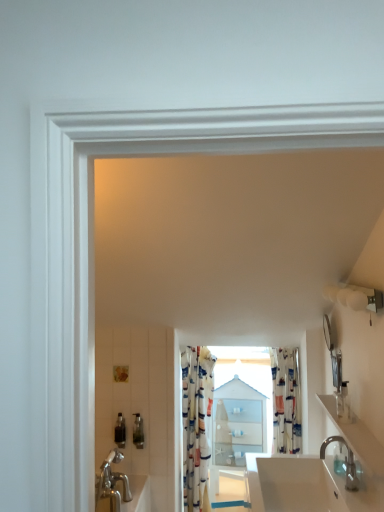
Where is `printed fabric shower curtain at center, the 2th shower curtain in the left-to-right sequence`? The height and width of the screenshot is (512, 384). printed fabric shower curtain at center, the 2th shower curtain in the left-to-right sequence is located at coordinates [x=286, y=400].

What do you see at coordinates (297, 484) in the screenshot? The height and width of the screenshot is (512, 384). I see `white glossy sink at lower center` at bounding box center [297, 484].

What do you see at coordinates (343, 402) in the screenshot? I see `clear plastic soap dispenser at right, the first toiletry positioned from the top` at bounding box center [343, 402].

Locate an element on the screen. The image size is (384, 512). clear plastic soap dispenser at right, positioned as the 2th toiletry in bottom-to-top order is located at coordinates (343, 402).

What do you see at coordinates (120, 431) in the screenshot?
I see `translucent plastic soap dispenser at lower left, which is counted as the first toiletry, starting from the bottom` at bounding box center [120, 431].

Find the location of `printed fabric shower curtain at center, the 1th shower curtain positioned from the right`. printed fabric shower curtain at center, the 1th shower curtain positioned from the right is located at coordinates (286, 400).

Which object is positioned more to the left, translucent plastic soap dispenser at lower left, the 2th toiletry viewed from the front, or white glossy countertop at lower right?

translucent plastic soap dispenser at lower left, the 2th toiletry viewed from the front.

Which point is more distant from viewer, (117,428) or (364,504)?

The point (117,428) is behind.

From a real-world perspective, is translucent plastic soap dispenser at lower left, positioned as the 1th toiletry in back-to-front order, under white glossy countertop at lower right?

Yes, from a real-world perspective, translucent plastic soap dispenser at lower left, positioned as the 1th toiletry in back-to-front order, is below white glossy countertop at lower right.

Considering the relative sizes of translucent plastic soap dispenser at lower left, the 2th toiletry in the top-to-bottom sequence, and white glossy countertop at lower right in the image provided, is translucent plastic soap dispenser at lower left, the 2th toiletry in the top-to-bottom sequence, smaller than white glossy countertop at lower right?

Yes.

From the image's perspective, between floral fabric shower curtain at center, which ranks as the 1th shower curtain in left-to-right order, and white glossy sink at lower center, which one is located above?

white glossy sink at lower center.

Is floral fabric shower curtain at center, arranged as the second shower curtain when viewed from the right, next to white glossy sink at lower center?

They are not placed beside each other.

Looking at this image, is floral fabric shower curtain at center, arranged as the second shower curtain when viewed from the right, spatially inside white glossy sink at lower center, or outside of it?

floral fabric shower curtain at center, arranged as the second shower curtain when viewed from the right, is outside white glossy sink at lower center.

Based on their sizes in the image, would you say floral fabric shower curtain at center, which ranks as the 1th shower curtain in left-to-right order, is bigger or smaller than white glossy sink at lower center?

In the image, floral fabric shower curtain at center, which ranks as the 1th shower curtain in left-to-right order, appears to be larger than white glossy sink at lower center.

Which object is wider, white glossy cabinet at center or floral fabric shower curtain at center, arranged as the second shower curtain when viewed from the right?

white glossy cabinet at center.

Is white glossy cabinet at center positioned with its back to floral fabric shower curtain at center, which ranks as the 1th shower curtain in left-to-right order?

No, floral fabric shower curtain at center, which ranks as the 1th shower curtain in left-to-right order, is not at the back of white glossy cabinet at center.

Measure the distance from white glossy cabinet at center to floral fabric shower curtain at center, arranged as the second shower curtain when viewed from the right.

white glossy cabinet at center is 22.67 centimeters from floral fabric shower curtain at center, arranged as the second shower curtain when viewed from the right.

Is white glossy cabinet at center directly adjacent to floral fabric shower curtain at center, which ranks as the 1th shower curtain in left-to-right order?

There is a gap between white glossy cabinet at center and floral fabric shower curtain at center, which ranks as the 1th shower curtain in left-to-right order.

Based on their positions, is glossy metallic mirror at upper right located to the left or right of silver metallic faucet at lower right?

In the image, glossy metallic mirror at upper right appears on the right side of silver metallic faucet at lower right.

From a real-world perspective, is glossy metallic mirror at upper right located beneath silver metallic faucet at lower right?

No.

From the picture: Which is less distant, (x=332, y=351) or (x=355, y=485)?

Point (x=332, y=351) is positioned farther from the camera compared to point (x=355, y=485).

From the picture: Does glossy metallic mirror at upper right have a lesser height compared to silver metallic faucet at lower right?

Incorrect, the height of glossy metallic mirror at upper right does not fall short of that of silver metallic faucet at lower right.

Do you think printed fabric shower curtain at center, the 2th shower curtain in the left-to-right sequence, is within clear plastic soap dispenser at right, marked as the 1th toiletry in a right-to-left arrangement, or outside of it?

printed fabric shower curtain at center, the 2th shower curtain in the left-to-right sequence, cannot be found inside clear plastic soap dispenser at right, marked as the 1th toiletry in a right-to-left arrangement.

Is printed fabric shower curtain at center, the 2th shower curtain in the left-to-right sequence, positioned far away from clear plastic soap dispenser at right, which appears as the 2th toiletry when viewed from the left?

That's not correct — printed fabric shower curtain at center, the 2th shower curtain in the left-to-right sequence, is a little close to clear plastic soap dispenser at right, which appears as the 2th toiletry when viewed from the left.

Which object is further away from the camera taking this photo, printed fabric shower curtain at center, the 2th shower curtain in the left-to-right sequence, or clear plastic soap dispenser at right, positioned as the 2th toiletry in bottom-to-top order?

printed fabric shower curtain at center, the 2th shower curtain in the left-to-right sequence, is further away from the camera.

From a real-world perspective, between printed fabric shower curtain at center, the 1th shower curtain positioned from the right, and clear plastic soap dispenser at right, the first toiletry positioned from the top, who is vertically lower?

printed fabric shower curtain at center, the 1th shower curtain positioned from the right, is physically lower.

Between translucent plastic soap dispenser at lower left, the 2th toiletry viewed from the front, and clear plastic soap dispenser at right, marked as the 1th toiletry in a right-to-left arrangement, which one appears on the left side from the viewer's perspective?

translucent plastic soap dispenser at lower left, the 2th toiletry viewed from the front, is more to the left.

Locate an element on the screen. The width and height of the screenshot is (384, 512). toiletry below the clear plastic soap dispenser at right, which appears as the 2th toiletry when viewed from the left (from the image's perspective) is located at coordinates (120, 431).

From the image's perspective, which one is positioned higher, translucent plastic soap dispenser at lower left, the 2th toiletry in the top-to-bottom sequence, or clear plastic soap dispenser at right, marked as the 1th toiletry in a right-to-left arrangement?

From the image's view, clear plastic soap dispenser at right, marked as the 1th toiletry in a right-to-left arrangement, is above.

Between white glossy countertop at lower right and printed fabric shower curtain at center, the 1th shower curtain positioned from the right, which one has smaller size?

With smaller size is white glossy countertop at lower right.

Is white glossy countertop at lower right next to printed fabric shower curtain at center, the 1th shower curtain positioned from the right, and touching it?

white glossy countertop at lower right and printed fabric shower curtain at center, the 1th shower curtain positioned from the right, are not in contact.

Which of these two, white glossy countertop at lower right or printed fabric shower curtain at center, the 1th shower curtain positioned from the right, stands taller?

Standing taller between the two is printed fabric shower curtain at center, the 1th shower curtain positioned from the right.

I want to click on counter top above the translucent plastic soap dispenser at lower left, the 2th toiletry in the top-to-bottom sequence (from the image's perspective), so click(360, 461).

The image size is (384, 512). I want to click on shower curtain on the left of white glossy sink at lower center, so click(196, 425).

Based on their spatial positions, is white glossy countertop at lower right or white glossy sink at lower center closer to floral fabric shower curtain at center, which ranks as the 1th shower curtain in left-to-right order?

white glossy sink at lower center is positioned closer to the anchor floral fabric shower curtain at center, which ranks as the 1th shower curtain in left-to-right order.

Based on their spatial positions, is white glossy countertop at lower right or clear plastic soap dispenser at right, positioned as the 1th toiletry in front-to-back order, further from floral fabric shower curtain at center, which ranks as the 1th shower curtain in left-to-right order?

Based on the image, clear plastic soap dispenser at right, positioned as the 1th toiletry in front-to-back order, appears to be further to floral fabric shower curtain at center, which ranks as the 1th shower curtain in left-to-right order.

When comparing their distances from white glossy countertop at lower right, does floral fabric shower curtain at center, arranged as the second shower curtain when viewed from the right, or clear plastic soap dispenser at right, positioned as the 2th toiletry in back-to-front order, seem closer?

clear plastic soap dispenser at right, positioned as the 2th toiletry in back-to-front order, lies closer to white glossy countertop at lower right than the other object.

Looking at the image, which one is located further to printed fabric shower curtain at center, the 1th shower curtain positioned from the right, white glossy sink at lower center or white glossy countertop at lower right?

white glossy countertop at lower right lies further to printed fabric shower curtain at center, the 1th shower curtain positioned from the right, than the other object.

Considering their positions, is floral fabric shower curtain at center, which ranks as the 1th shower curtain in left-to-right order, positioned further to white glossy sink at lower center than translucent plastic soap dispenser at lower left, the 2th toiletry viewed from the front?

translucent plastic soap dispenser at lower left, the 2th toiletry viewed from the front.

Which object lies further to the anchor point floral fabric shower curtain at center, which ranks as the 1th shower curtain in left-to-right order, translucent plastic soap dispenser at lower left, positioned as the 1th toiletry in back-to-front order, or clear plastic soap dispenser at right, positioned as the 1th toiletry in front-to-back order?

clear plastic soap dispenser at right, positioned as the 1th toiletry in front-to-back order, lies further to floral fabric shower curtain at center, which ranks as the 1th shower curtain in left-to-right order, than the other object.

Based on their spatial positions, is floral fabric shower curtain at center, which ranks as the 1th shower curtain in left-to-right order, or clear plastic soap dispenser at right, marked as the 1th toiletry in a right-to-left arrangement, further from glossy metallic mirror at upper right?

Based on the image, floral fabric shower curtain at center, which ranks as the 1th shower curtain in left-to-right order, appears to be further to glossy metallic mirror at upper right.

When comparing their distances from white glossy sink at lower center, does silver metallic faucet at lower right or printed fabric shower curtain at center, the 2th shower curtain in the left-to-right sequence, seem further?

printed fabric shower curtain at center, the 2th shower curtain in the left-to-right sequence.

Where is `tap between clear plastic soap dispenser at right, positioned as the 2th toiletry in back-to-front order, and white glossy sink at lower center, in the vertical direction`? The height and width of the screenshot is (512, 384). tap between clear plastic soap dispenser at right, positioned as the 2th toiletry in back-to-front order, and white glossy sink at lower center, in the vertical direction is located at coordinates (345, 462).

Locate an element on the screen. Image resolution: width=384 pixels, height=512 pixels. toiletry between clear plastic soap dispenser at right, positioned as the 1th toiletry in front-to-back order, and white glossy cabinet at center from front to back is located at coordinates (120, 431).

The height and width of the screenshot is (512, 384). Find the location of `tap between translucent plastic soap dispenser at lower left, which is counted as the first toiletry, starting from the bottom, and glossy metallic mirror at upper right from left to right`. tap between translucent plastic soap dispenser at lower left, which is counted as the first toiletry, starting from the bottom, and glossy metallic mirror at upper right from left to right is located at coordinates (345, 462).

You are a GUI agent. You are given a task and a screenshot of the screen. Output one action in this format:
    pyautogui.click(x=<x>, y=<y>)
    Task: Click on the mirror between clear plastic soap dispenser at right, positioned as the 2th toiletry in back-to-front order, and printed fabric shower curtain at center, the 1th shower curtain positioned from the right, along the z-axis
    The width and height of the screenshot is (384, 512).
    Given the screenshot: What is the action you would take?
    pyautogui.click(x=333, y=354)